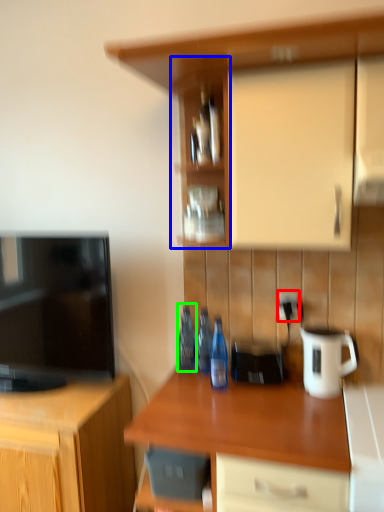
Question: Which object is positioned farthest from electric outlet (highlighted by a red box)? Select from shelf (highlighted by a blue box) and bottle (highlighted by a green box).

Choices:
 (A) shelf
 (B) bottle

Answer: (A)